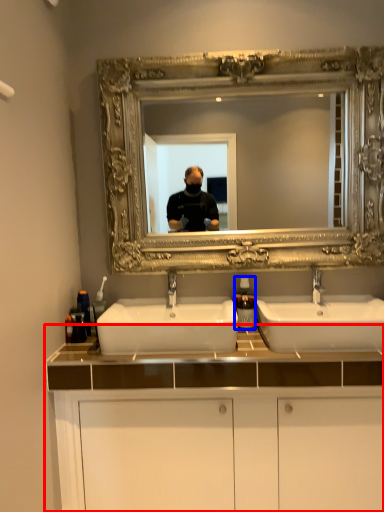
Question: Which object appears farthest to the camera in this image, bathroom cabinet (highlighted by a red box) or soap dispenser (highlighted by a blue box)?

Choices:
 (A) bathroom cabinet
 (B) soap dispenser

Answer: (B)